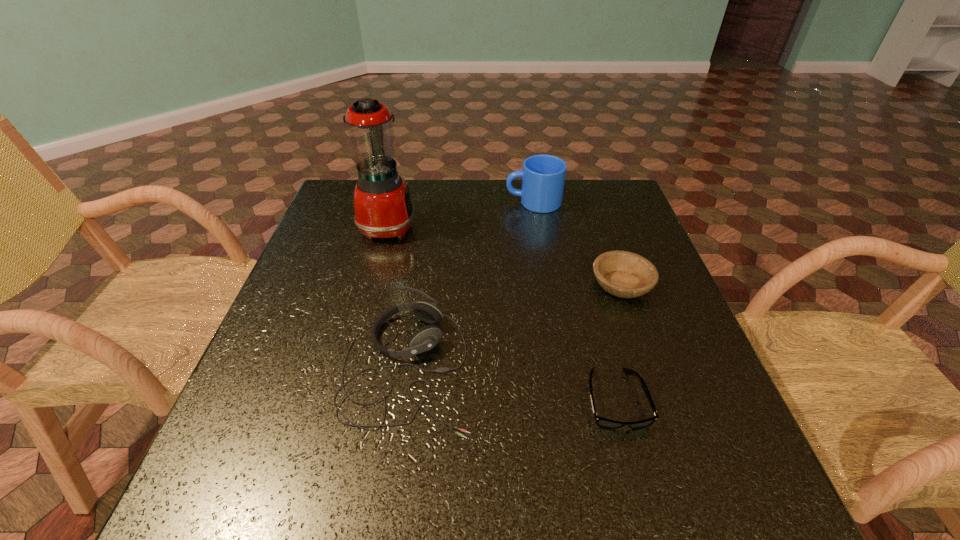
Identify the location of food processor. The image size is (960, 540). (383, 208).

The height and width of the screenshot is (540, 960). I want to click on the second tallest object, so point(543,176).

Locate an element on the screen. the third shortest object is located at coordinates (425, 338).

Locate an element on the screen. This screenshot has width=960, height=540. bowl is located at coordinates (624, 274).

Locate an element on the screen. the third nearest object is located at coordinates (624, 274).

The height and width of the screenshot is (540, 960). Find the location of `sunglasses`. sunglasses is located at coordinates (602, 422).

I want to click on vacant space located 0.090m on the controls of the tallest object, so click(447, 225).

The width and height of the screenshot is (960, 540). I want to click on vacant point located on the side of the mug with the handle, so click(445, 202).

The height and width of the screenshot is (540, 960). Find the location of `free space located 0.310m on the side of the mug with the handle`. free space located 0.310m on the side of the mug with the handle is located at coordinates (402, 202).

You are a GUI agent. You are given a task and a screenshot of the screen. Output one action in this format:
    pyautogui.click(x=<x>, y=<y>)
    Task: Click on the vacant point located on the side of the mug with the handle
    
    Given the screenshot: What is the action you would take?
    pyautogui.click(x=396, y=202)